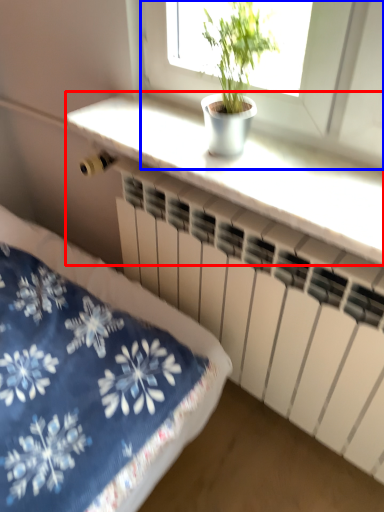
Question: Which point is closer to the camera, counter top (highlighted by a red box) or window (highlighted by a blue box)?

Choices:
 (A) counter top
 (B) window

Answer: (B)